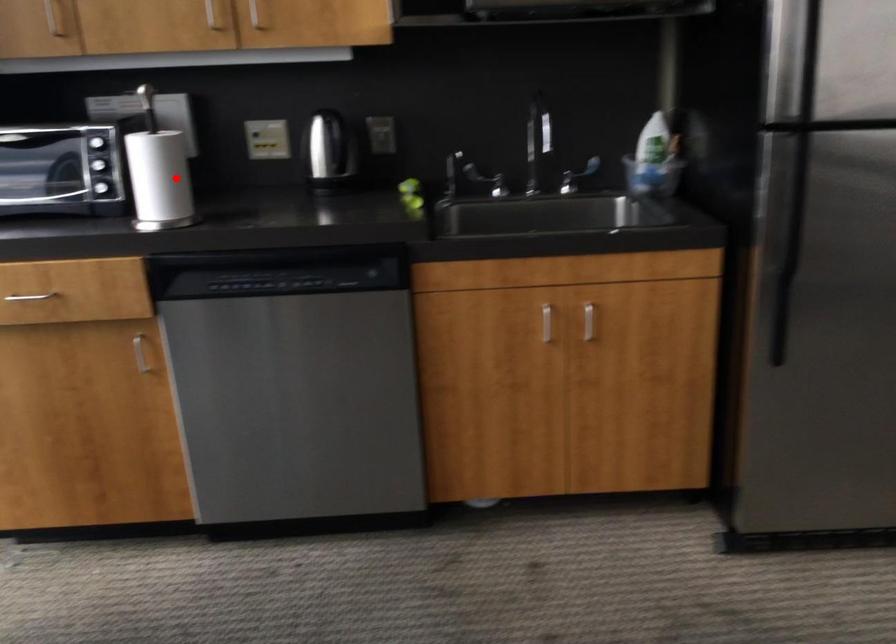
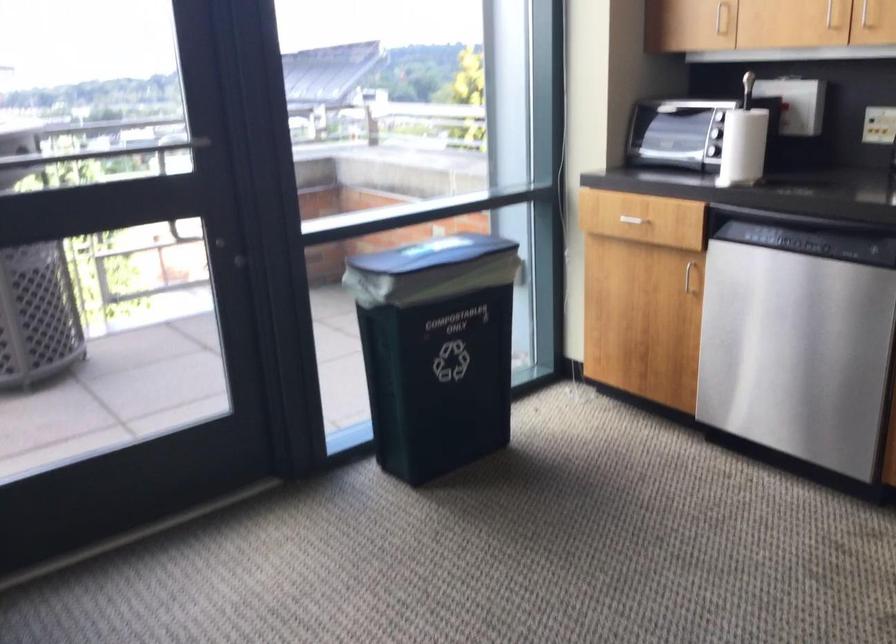
Question: I am providing you with two images of the same scene from different viewpoints. In image1, a red point is highlighted. Considering the same 3D point in image2, which of the following is correct?

Choices:
 (A) It is closer
 (B) It is farther

Answer: (B)